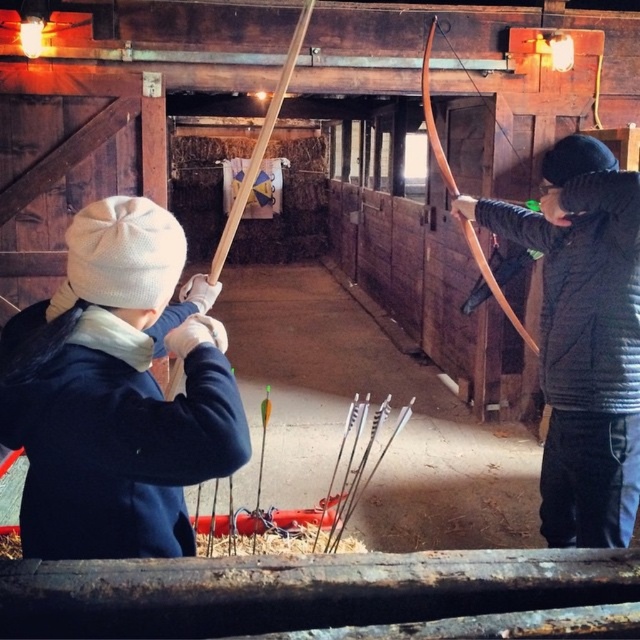
From the picture: You are an archery instructor observing two students in the barn. The students are wearing the matte blue jacket at left and the matte black jacket at right. Which student is shorter in height?

The matte blue jacket at left is shorter in height compared to the matte black jacket at right, so the student wearing the matte blue jacket at left is shorter.

From the picture: Based on the coordinates provided, which object is located at point (115, 394) in the scene?

The point (115, 394) corresponds to the matte blue jacket at left.

In the scene shown: You are an archer preparing to shoot an arrow. You notice the matte black jacket at right and the wooden bow at center in your line of sight. Which object is closer to you?

The matte black jacket at right is in front of the wooden bow at center, so it is closer to you.